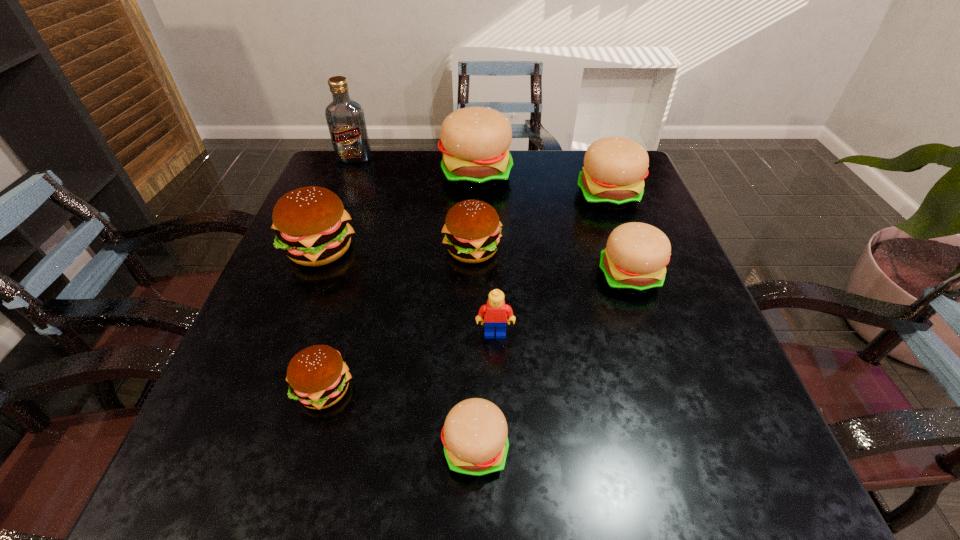
In order to click on vacant space at the near right corner in this screenshot , I will do `click(703, 454)`.

This screenshot has width=960, height=540. Identify the location of free spot between the second smallest brown hamburger and the second smallest beige hamburger. [551, 263].

The height and width of the screenshot is (540, 960). I want to click on empty space that is in between the smallest brown hamburger and the second smallest beige hamburger, so click(477, 333).

Locate an element on the screen. This screenshot has width=960, height=540. empty location between the second biggest brown hamburger and the second biggest beige hamburger is located at coordinates (540, 223).

You are a GUI agent. You are given a task and a screenshot of the screen. Output one action in this format:
    pyautogui.click(x=<x>, y=<y>)
    Task: Click on the free area in between the seventh farthest object and the third smallest beige hamburger
    
    Given the screenshot: What is the action you would take?
    pyautogui.click(x=552, y=265)

Where is `free space between the second nearest beige hamburger and the second biggest brown hamburger`? This screenshot has width=960, height=540. free space between the second nearest beige hamburger and the second biggest brown hamburger is located at coordinates (551, 263).

This screenshot has height=540, width=960. I want to click on vacant space that's between the tallest object and the second nearest object, so click(339, 274).

Where is `vacant region between the biggest beige hamburger and the vodka`? This screenshot has height=540, width=960. vacant region between the biggest beige hamburger and the vodka is located at coordinates (416, 166).

You are a GUI agent. You are given a task and a screenshot of the screen. Output one action in this format:
    pyautogui.click(x=<x>, y=<y>)
    Task: Click on the free space between the nearest object and the smallest brown hamburger
    The image size is (960, 540).
    Given the screenshot: What is the action you would take?
    pyautogui.click(x=399, y=419)

Point out which object is positioned as the fourth nearest to the tallest object. Please provide its 2D coordinates. Your answer should be formatted as a tuple, i.e. [(x, y)], where the tuple contains the x and y coordinates of a point satisfying the conditions above.

[(614, 170)]